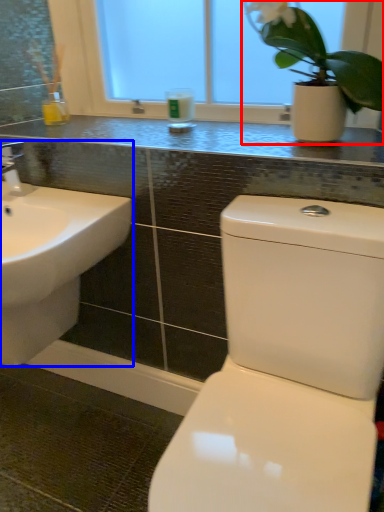
Question: Which point is further to the camera, houseplant (highlighted by a red box) or sink (highlighted by a blue box)?

Choices:
 (A) houseplant
 (B) sink

Answer: (B)